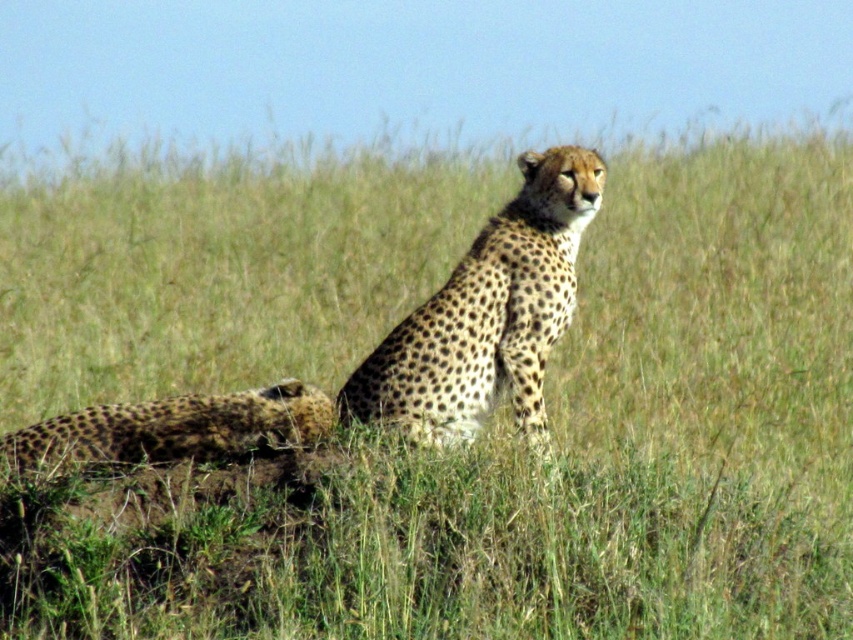
Question: Which object is farther from the camera taking this photo?

Choices:
 (A) spotted fur cheetah at lower left
 (B) spotted fur cheetah at center

Answer: (A)

Question: Is spotted fur cheetah at center above spotted fur cheetah at lower left?

Choices:
 (A) no
 (B) yes

Answer: (B)

Question: Is spotted fur cheetah at center thinner than spotted fur cheetah at lower left?

Choices:
 (A) yes
 (B) no

Answer: (A)

Question: Which point is farther to the camera?

Choices:
 (A) spotted fur cheetah at lower left
 (B) spotted fur cheetah at center

Answer: (A)

Question: Which point appears closest to the camera in this image?

Choices:
 (A) (428, 300)
 (B) (115, 442)

Answer: (B)

Question: Is spotted fur cheetah at center smaller than spotted fur cheetah at lower left?

Choices:
 (A) no
 (B) yes

Answer: (A)